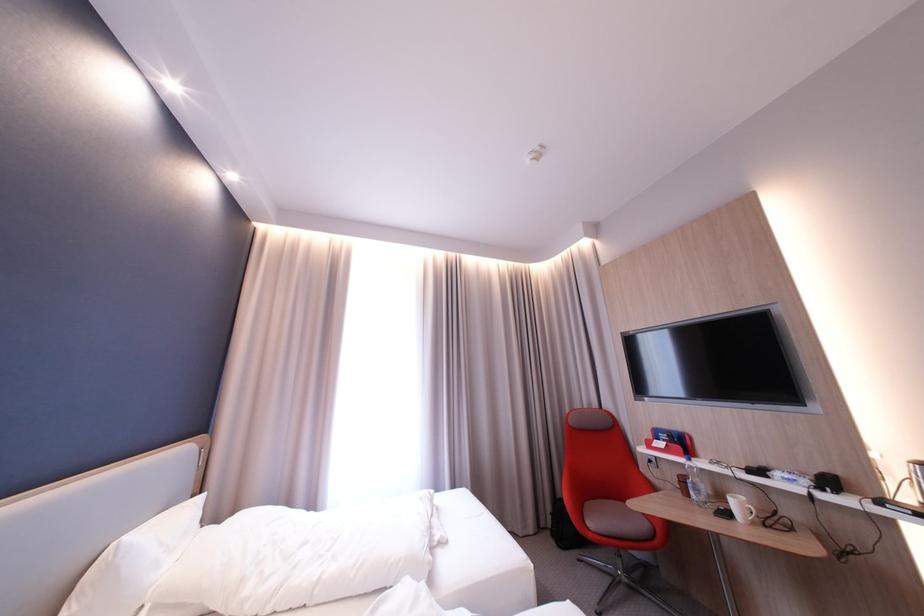
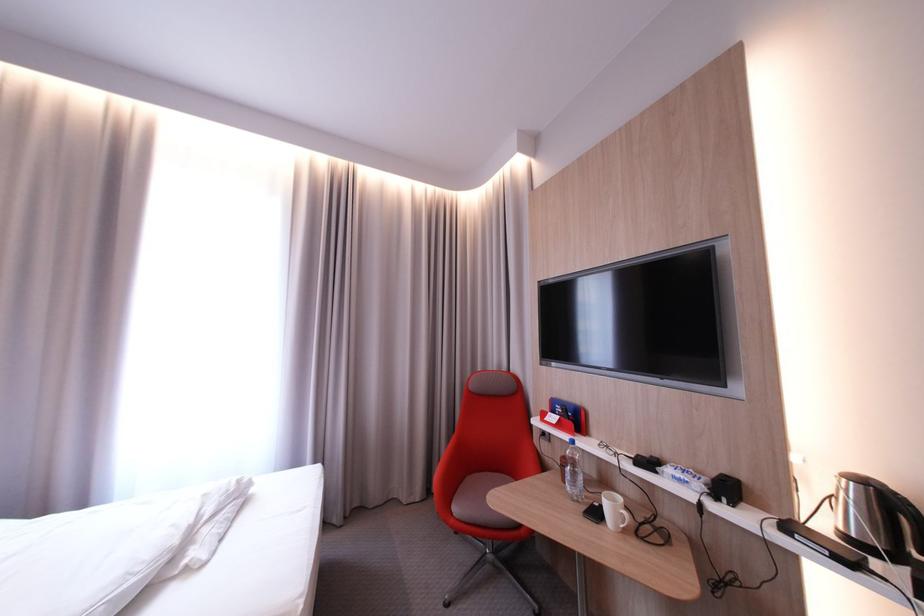
Where in the second image is the point corresponding to (671,435) from the first image?

(568, 407)